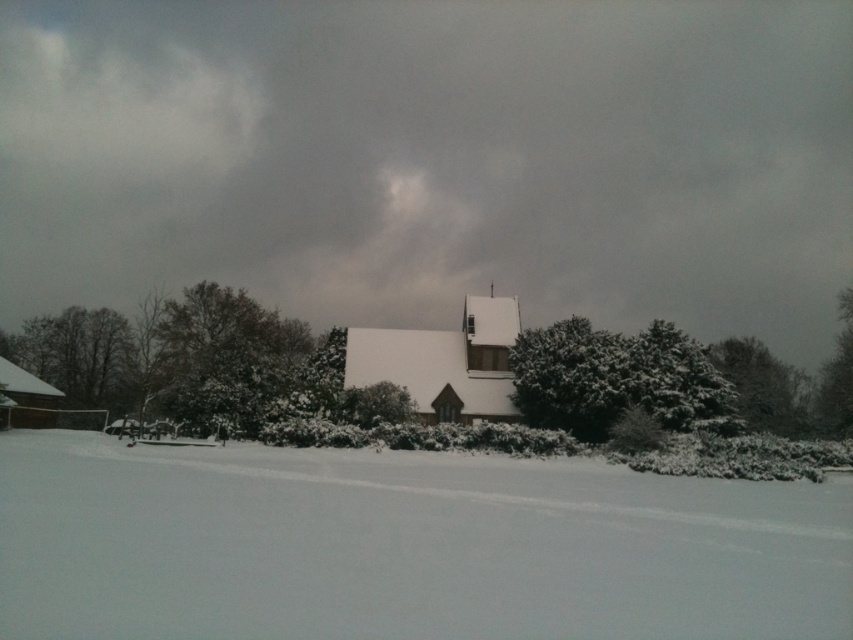
Question: Which point is closer to the camera?

Choices:
 (A) (839, 314)
 (B) (585, 296)
 (C) (358, 348)
 (D) (91, 396)

Answer: (C)

Question: Which point appears closest to the camera in this image?

Choices:
 (A) (473, 307)
 (B) (283, 150)
 (C) (103, 316)

Answer: (A)

Question: Can you confirm if cloudy gray sky at upper center is smaller than snowy evergreen tree at right?

Choices:
 (A) yes
 (B) no

Answer: (B)

Question: Which object is closer to the camera taking this photo?

Choices:
 (A) white wooden church at center
 (B) white fluffy snow at lower center
 (C) green leafy tree at left
 (D) green textured tree at right

Answer: (B)

Question: Is white fluffy snow at lower center positioned before white wooden church at center?

Choices:
 (A) no
 (B) yes

Answer: (B)

Question: Is cloudy gray sky at upper center to the right of white wooden church at center from the viewer's perspective?

Choices:
 (A) no
 (B) yes

Answer: (A)